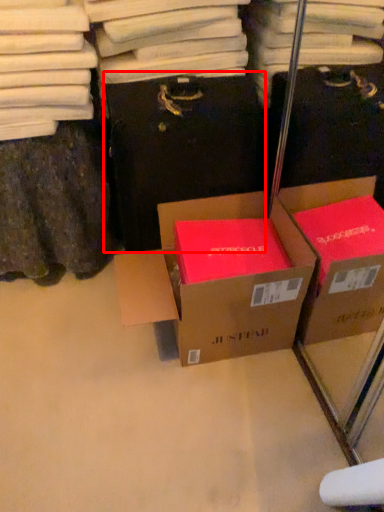
Question: From the image, what is the correct spatial relationship of cardboard box (annotated by the red box) in relation to box?

Choices:
 (A) left
 (B) right

Answer: (A)